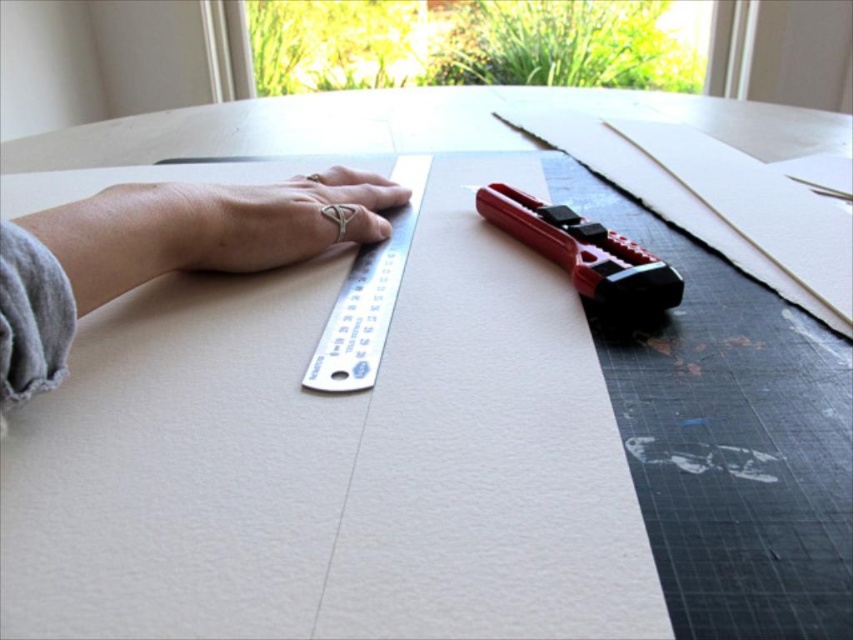
You are trying to cut a piece of paper precisely. You have a silver metallic ruler at left and a gold metallic ring at center. Which object is closer to you when you look at the scene?

The silver metallic ruler at left is closer to you because it is in front of the gold metallic ring at center.

You are organizing your desk and need to place a new item between the silver metallic ruler at left and the red plastic stapler at upper right. Can you fit it if the item requires 5 inches of space?

The silver metallic ruler at left is 6.00 inches away from the red plastic stapler at upper right, so yes, the item requiring 5 inches of space can fit between them.

You are an assistant helping someone craft a ring holder. You see the gold metallic ring at center and the silver metallic ruler at center. Which object is closer to you?

The gold metallic ring at center is closer to you because the silver metallic ruler at center is behind it.